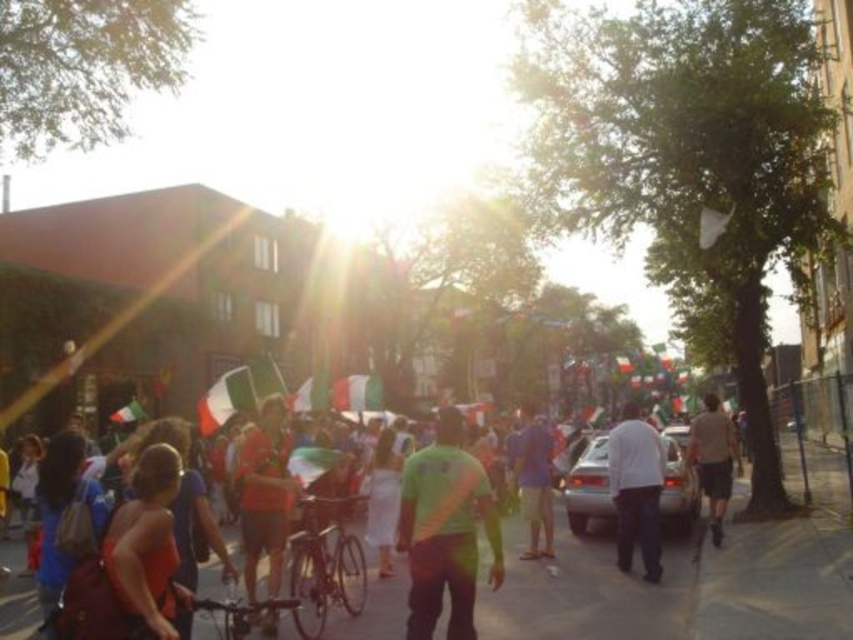
This screenshot has width=853, height=640. What do you see at coordinates (688, 580) in the screenshot? I see `gray concrete sidewalk at center` at bounding box center [688, 580].

Does gray concrete sidewalk at center appear on the right side of light brown shorts at center?

No, gray concrete sidewalk at center is not to the right of light brown shorts at center.

This screenshot has height=640, width=853. What are the coordinates of `gray concrete sidewalk at center` in the screenshot? It's located at (688, 580).

Identify the location of gray concrete sidewalk at center. The width and height of the screenshot is (853, 640). (688, 580).

Who is higher up, green matte shirt at center or light brown shorts at center?

Positioned higher is green matte shirt at center.

Measure the distance between green matte shirt at center and camera.

green matte shirt at center is 7.78 meters away from camera.

Is point (430, 576) positioned before point (712, 516)?

Yes, point (430, 576) is in front of point (712, 516).

The image size is (853, 640). Find the location of `green matte shirt at center`. green matte shirt at center is located at coordinates (445, 531).

Between point (148, 484) and point (546, 547), which one is positioned behind?

The point (546, 547) is more distant.

This screenshot has width=853, height=640. Describe the element at coordinates (148, 544) in the screenshot. I see `matte red dress at lower left` at that location.

Locate an element on the screen. matte red dress at lower left is located at coordinates (148, 544).

This screenshot has width=853, height=640. Find the location of `matte red dress at lower left`. matte red dress at lower left is located at coordinates (148, 544).